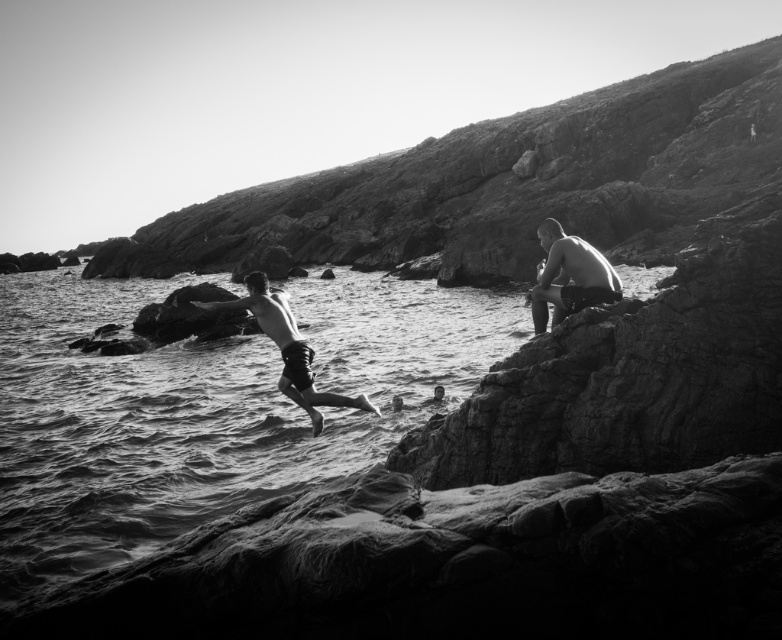
Between smooth water at mid-left and smooth skin man at right, which one is positioned lower?

smooth water at mid-left is below.

Does smooth water at mid-left have a lesser width compared to smooth skin man at right?

No, smooth water at mid-left is not thinner than smooth skin man at right.

Identify the location of smooth water at mid-left. This screenshot has width=782, height=640. (205, 408).

Does smooth water at mid-left appear under smooth skin man at center?

No.

Is point (404, 320) less distant than point (293, 392)?

No, (404, 320) is behind (293, 392).

Between point (198, 394) and point (257, 323), which one is positioned in front?

Point (257, 323) is in front.

You are a GUI agent. You are given a task and a screenshot of the screen. Output one action in this format:
    pyautogui.click(x=<x>, y=<y>)
    Task: Click on the smooth water at mid-left
    
    Given the screenshot: What is the action you would take?
    pyautogui.click(x=205, y=408)

Can you confirm if smooth skin man at right is shorter than smooth skin man at center?

Indeed, smooth skin man at right has a lesser height compared to smooth skin man at center.

Who is shorter, smooth skin man at right or smooth skin man at center?

With less height is smooth skin man at right.

Does point (546, 244) come in front of point (339, 401)?

No, it is not.

This screenshot has height=640, width=782. What are the coordinates of `smooth skin man at right` in the screenshot? It's located at (569, 276).